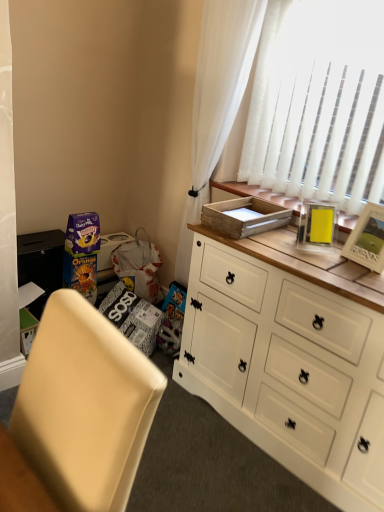
What is the approximate width of white sheer curtain at upper right?

The width of white sheer curtain at upper right is 6.64 inches.

The image size is (384, 512). What do you see at coordinates (217, 99) in the screenshot?
I see `white sheer curtain at upper right` at bounding box center [217, 99].

What do you see at coordinates (288, 365) in the screenshot? I see `white wood cabinet at center` at bounding box center [288, 365].

What is the approximate width of wooden tray at upper right?

wooden tray at upper right is 15.05 inches wide.

The image size is (384, 512). What are the coordinates of `wooden picture frame at upper right` in the screenshot? It's located at (367, 239).

This screenshot has height=512, width=384. What do you see at coordinates (85, 406) in the screenshot?
I see `beige fabric chair at lower left` at bounding box center [85, 406].

I want to click on white sheer curtain at upper right, so click(217, 99).

Considering the positions of objects white wood cabinet at center and wooden tray at upper right in the image provided, who is in front, white wood cabinet at center or wooden tray at upper right?

Positioned in front is white wood cabinet at center.

Is wooden tray at upper right surrounded by white wood cabinet at center?

That's incorrect, wooden tray at upper right is not inside white wood cabinet at center.

Is white wood cabinet at center taller than wooden tray at upper right?

Correct, white wood cabinet at center is much taller as wooden tray at upper right.

Considering the sizes of objects white wood cabinet at center and wooden tray at upper right in the image provided, who is smaller, white wood cabinet at center or wooden tray at upper right?

wooden tray at upper right.

From the picture: Would you say white wood cabinet at center contains beige fabric chair at lower left?

Actually, beige fabric chair at lower left is outside white wood cabinet at center.

Is the position of white wood cabinet at center less distant than that of beige fabric chair at lower left?

No, the depth of white wood cabinet at center is greater than that of beige fabric chair at lower left.

Would you say white wood cabinet at center is to the left or to the right of beige fabric chair at lower left in the picture?

In the image, white wood cabinet at center appears on the right side of beige fabric chair at lower left.

Is matte cardboard box at lower left shorter than beige fabric chair at lower left?

Yes.

Is matte cardboard box at lower left aimed at beige fabric chair at lower left?

No, matte cardboard box at lower left is not turned towards beige fabric chair at lower left.

From the image's perspective, is matte cardboard box at lower left above or below beige fabric chair at lower left?

Based on their image positions, matte cardboard box at lower left is located above beige fabric chair at lower left.

Which object is positioned more to the left, matte cardboard box at lower left or beige fabric chair at lower left?

Positioned to the left is matte cardboard box at lower left.

Who is shorter, wooden tray at upper right or beige fabric chair at lower left?

With less height is wooden tray at upper right.

Is wooden tray at upper right directly adjacent to beige fabric chair at lower left?

No, wooden tray at upper right is not beside beige fabric chair at lower left.

Is wooden tray at upper right facing towards beige fabric chair at lower left?

No, wooden tray at upper right is not facing towards beige fabric chair at lower left.

How distant is wooden tray at upper right from beige fabric chair at lower left?

wooden tray at upper right and beige fabric chair at lower left are 3.61 feet apart.

Which object is positioned more to the right, beige fabric chair at lower left or white wood cabinet at center?

white wood cabinet at center is more to the right.

Consider the image. How many degrees apart are the facing directions of beige fabric chair at lower left and white wood cabinet at center?

They differ by 7.26 degrees in their facing directions.

Is beige fabric chair at lower left wider or thinner than white wood cabinet at center?

Considering their sizes, beige fabric chair at lower left looks slimmer than white wood cabinet at center.

Are beige fabric chair at lower left and white wood cabinet at center far apart?

Absolutely, beige fabric chair at lower left is distant from white wood cabinet at center.

Does wooden tray at upper right have a lesser width compared to matte cardboard box at lower left?

No.

Is wooden tray at upper right turned away from matte cardboard box at lower left?

No, wooden tray at upper right is not facing away from matte cardboard box at lower left.

In the scene shown: Is the position of wooden tray at upper right less distant than that of matte cardboard box at lower left?

Yes, wooden tray at upper right is closer to the viewer.

From the image's perspective, relative to matte cardboard box at lower left, is wooden tray at upper right above or below?

Clearly, from the image's perspective, wooden tray at upper right is above matte cardboard box at lower left.

Is wooden picture frame at upper right smaller than white wood cabinet at center?

Yes.

From a real-world perspective, between wooden picture frame at upper right and white wood cabinet at center, who is vertically lower?

white wood cabinet at center.

Considering the sizes of wooden picture frame at upper right and white wood cabinet at center in the image, is wooden picture frame at upper right taller or shorter than white wood cabinet at center?

Clearly, wooden picture frame at upper right is shorter compared to white wood cabinet at center.

Looking at their sizes, would you say wooden picture frame at upper right is wider or thinner than white wood cabinet at center?

Clearly, wooden picture frame at upper right has less width compared to white wood cabinet at center.

Find the location of `cardboard box behind the white wood cabinet at center`. cardboard box behind the white wood cabinet at center is located at coordinates pyautogui.click(x=244, y=216).

This screenshot has width=384, height=512. In the image, there is a beige fabric chair at lower left. What are the coordinates of `cabinetry above it (from the image's perspective)` in the screenshot? It's located at (288, 365).

Looking at the image, which one is located further to wooden tray at upper right, matte cardboard box at lower left or beige fabric chair at lower left?

Among the two, matte cardboard box at lower left is located further to wooden tray at upper right.

Looking at the image, which one is located closer to beige fabric chair at lower left, matte cardboard box at lower left or white wood cabinet at center?

white wood cabinet at center is positioned closer to the anchor beige fabric chair at lower left.

Considering their positions, is matte cardboard box at lower left positioned closer to white wood cabinet at center than wooden tray at upper right?

wooden tray at upper right lies closer to white wood cabinet at center than the other object.

Which object lies nearer to the anchor point matte cardboard box at lower left, white sheer curtain at upper right or beige fabric chair at lower left?

white sheer curtain at upper right is positioned closer to the anchor matte cardboard box at lower left.

Looking at the image, which one is located closer to wooden tray at upper right, white sheer curtain at upper right or beige fabric chair at lower left?

white sheer curtain at upper right lies closer to wooden tray at upper right than the other object.

Estimate the real-world distances between objects in this image. Which object is further from white sheer curtain at upper right, matte cardboard box at lower left or beige fabric chair at lower left?

beige fabric chair at lower left lies further to white sheer curtain at upper right than the other object.

Which object lies further to the anchor point white wood cabinet at center, white sheer curtain at upper right or wooden tray at upper right?

The object further to white wood cabinet at center is white sheer curtain at upper right.

From the image, which object appears to be farther from matte cardboard box at lower left, beige fabric chair at lower left or white wood cabinet at center?

beige fabric chair at lower left is further to matte cardboard box at lower left.

In order to click on curtain located between beige fabric chair at lower left and matte cardboard box at lower left in the depth direction in this screenshot , I will do `click(217, 99)`.

Image resolution: width=384 pixels, height=512 pixels. Identify the location of cabinetry positioned between beige fabric chair at lower left and white sheer curtain at upper right from near to far. (288, 365).

Find the location of a particular element. cabinetry between beige fabric chair at lower left and matte cardboard box at lower left from front to back is located at coordinates (288, 365).

Identify the location of picture frame positioned between beige fabric chair at lower left and white sheer curtain at upper right from near to far. (367, 239).